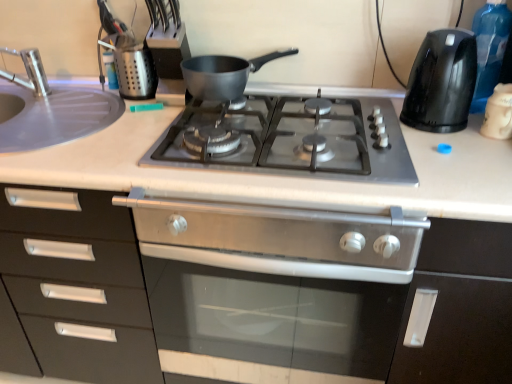
Question: Can you confirm if metallic silver utensil holder at upper left is bigger than transparent plastic bottle at right?

Choices:
 (A) yes
 (B) no

Answer: (B)

Question: Is metallic silver utensil holder at upper left completely or partially outside of transparent plastic bottle at right?

Choices:
 (A) no
 (B) yes

Answer: (B)

Question: Is metallic silver utensil holder at upper left facing away from transparent plastic bottle at right?

Choices:
 (A) yes
 (B) no

Answer: (B)

Question: From the image's perspective, would you say metallic silver utensil holder at upper left is shown under transparent plastic bottle at right?

Choices:
 (A) yes
 (B) no

Answer: (A)

Question: Is metallic silver utensil holder at upper left facing towards transparent plastic bottle at right?

Choices:
 (A) no
 (B) yes

Answer: (A)

Question: Does point (22, 89) appear closer or farther from the camera than point (416, 261)?

Choices:
 (A) farther
 (B) closer

Answer: (A)

Question: Considering the positions of satin steel sink at left and satin black oven at center in the image, is satin steel sink at left bigger or smaller than satin black oven at center?

Choices:
 (A) big
 (B) small

Answer: (B)

Question: Considering the relative positions of satin steel sink at left and satin black oven at center in the image provided, is satin steel sink at left to the left or to the right of satin black oven at center?

Choices:
 (A) left
 (B) right

Answer: (A)

Question: Is satin steel sink at left inside the boundaries of satin black oven at center, or outside?

Choices:
 (A) outside
 (B) inside

Answer: (A)

Question: Is black plastic kettle at right, which ranks as the second kitchen appliance in left-to-right order, in front of or behind silver metallic faucet at left in the image?

Choices:
 (A) front
 (B) behind

Answer: (A)

Question: From a real-world perspective, is black plastic kettle at right, the second kitchen appliance when ordered from right to left, above or below silver metallic faucet at left?

Choices:
 (A) below
 (B) above

Answer: (B)

Question: Is point (461, 31) closer or farther from the camera than point (26, 56)?

Choices:
 (A) closer
 (B) farther

Answer: (A)

Question: From the image's perspective, is black plastic kettle at right, which ranks as the second kitchen appliance in left-to-right order, positioned above or below silver metallic faucet at left?

Choices:
 (A) below
 (B) above

Answer: (A)

Question: Based on their sizes in the image, would you say satin black oven at center is bigger or smaller than black plastic kettle at right, the second kitchen appliance when ordered from right to left?

Choices:
 (A) big
 (B) small

Answer: (A)

Question: Is point (307, 339) positioned closer to the camera than point (402, 107)?

Choices:
 (A) farther
 (B) closer

Answer: (B)